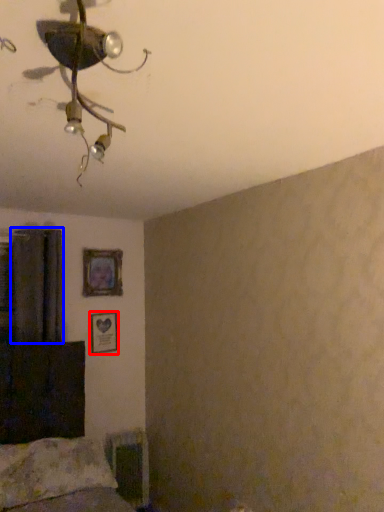
Question: Which object is closer to the camera taking this photo, picture frame (highlighted by a red box) or curtain (highlighted by a blue box)?

Choices:
 (A) picture frame
 (B) curtain

Answer: (B)